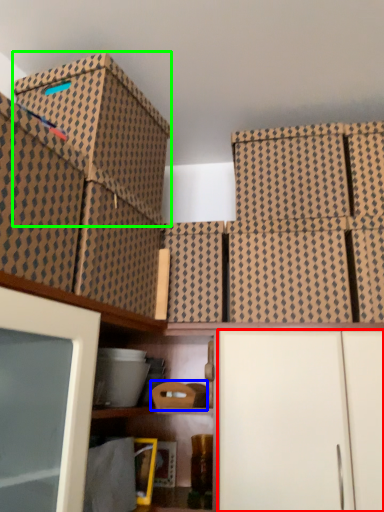
Question: Which is farther away from cabinetry (highlighted by a red box)? storage box (highlighted by a blue box) or storage box (highlighted by a green box)?

Choices:
 (A) storage box
 (B) storage box

Answer: (B)